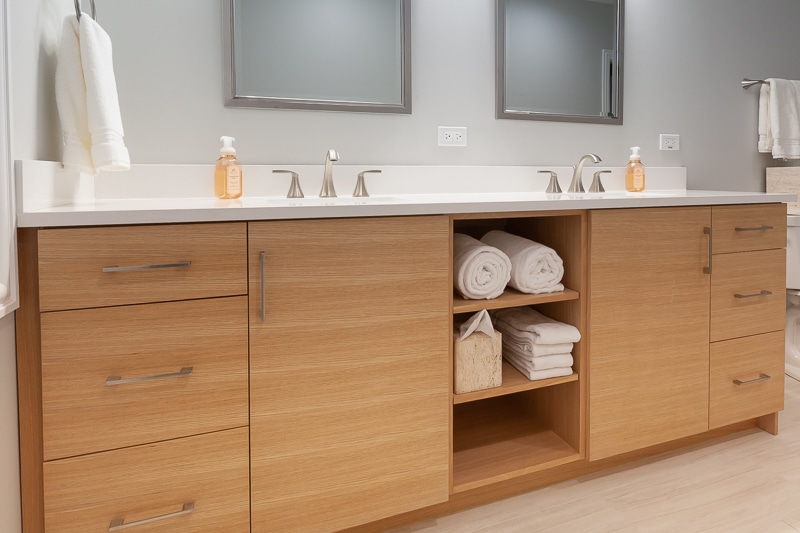
Image resolution: width=800 pixels, height=533 pixels. What are the coordinates of `counter cloth` in the screenshot? It's located at pos(104,83).